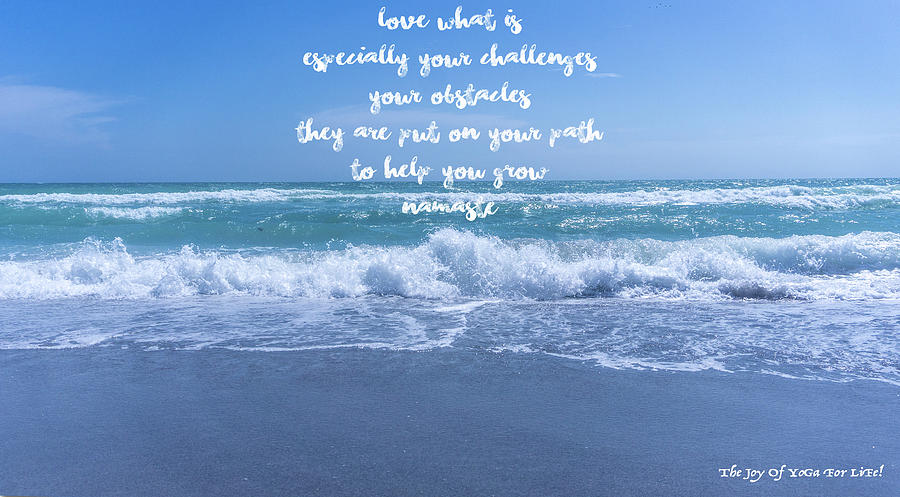
Locate an element on the screen. This screenshot has width=900, height=497. foam is located at coordinates [x=706, y=362].